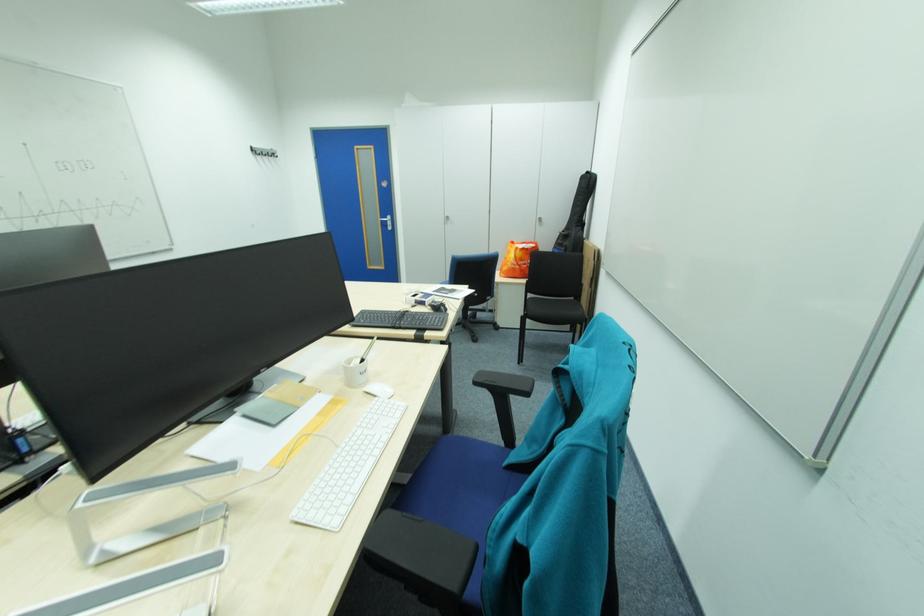
This screenshot has width=924, height=616. What do you see at coordinates (504, 384) in the screenshot? I see `a black chair armrest` at bounding box center [504, 384].